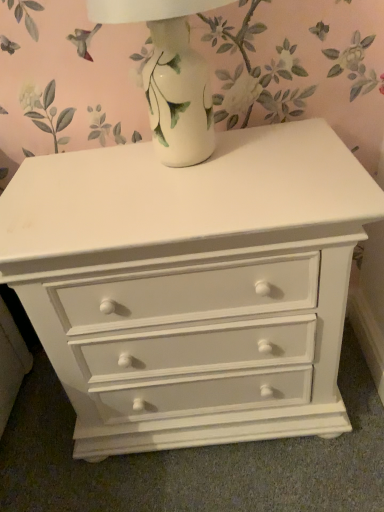
At what (x,y) coordinates should I click in order to perform the action: click on blank area beneath white glossy vase at upper center (from a real-world perspective). Please return your answer as a coordinate pair (x, y). The height and width of the screenshot is (512, 384). Looking at the image, I should click on (189, 162).